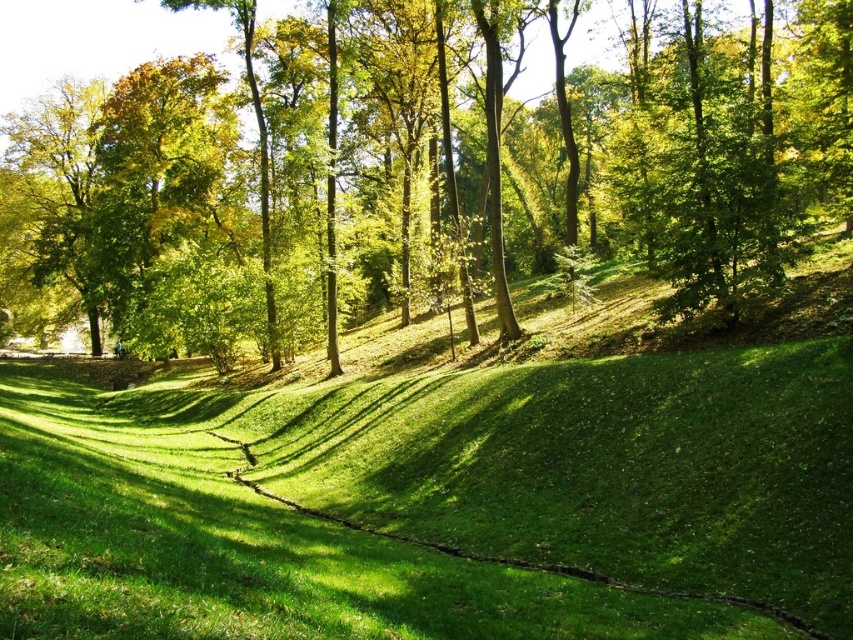
Question: From the image, what is the correct spatial relationship of green leafy tree at upper center in relation to green grassy at center?

Choices:
 (A) below
 (B) above

Answer: (B)

Question: Does green leafy tree at upper center have a lesser width compared to green grassy at center?

Choices:
 (A) no
 (B) yes

Answer: (A)

Question: Which point is closer to the camera taking this photo?

Choices:
 (A) (10, 296)
 (B) (515, 550)

Answer: (B)

Question: From the image, what is the correct spatial relationship of green leafy tree at upper center in relation to green grassy at center?

Choices:
 (A) right
 (B) left

Answer: (B)